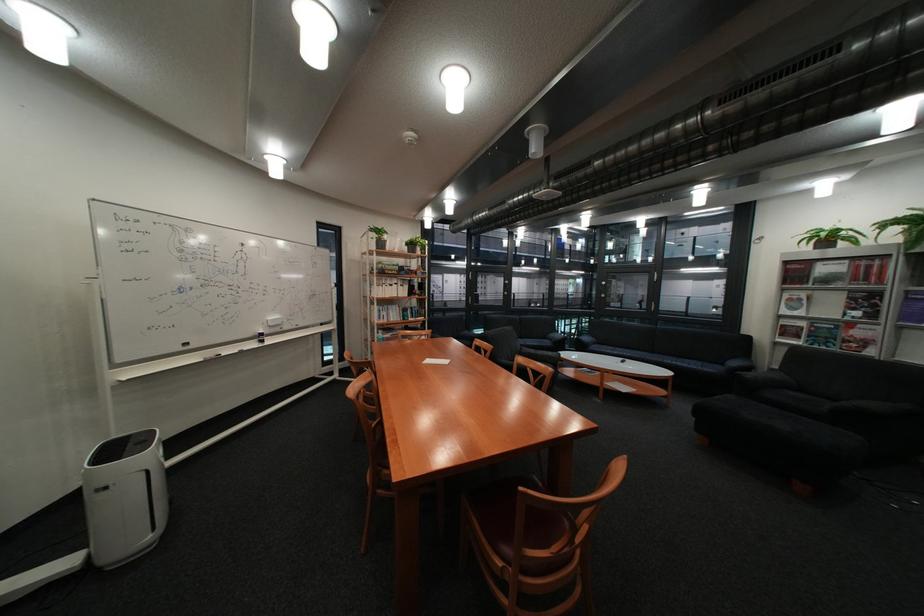
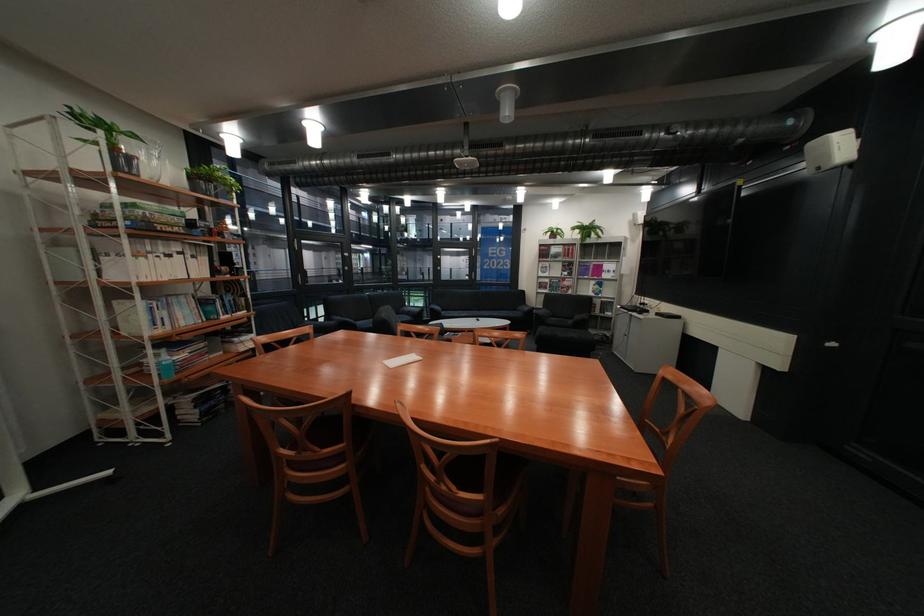
Where in the second image is the point corresponding to (x=637, y=353) from the first image?

(481, 315)